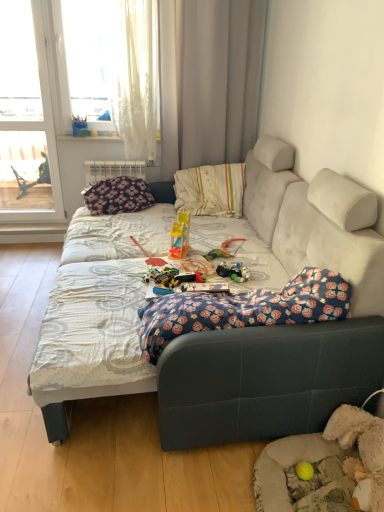
This screenshot has height=512, width=384. Find the location of `free space that is to the left of yellow rubber ball at lower right, which appears as the first toy when viewed from the front`. free space that is to the left of yellow rubber ball at lower right, which appears as the first toy when viewed from the front is located at coordinates (251, 473).